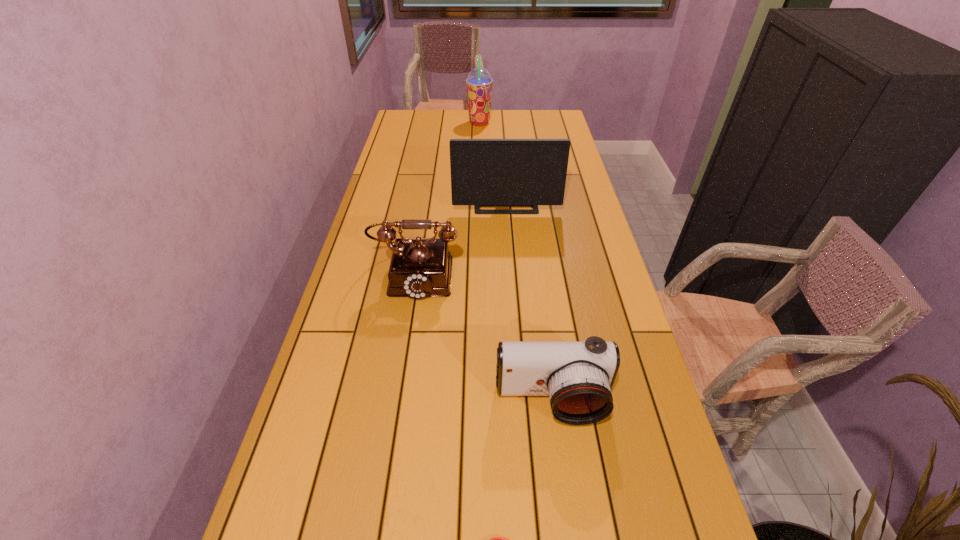
Locate an element on the screen. The height and width of the screenshot is (540, 960). object located at the far edge is located at coordinates (479, 82).

This screenshot has width=960, height=540. I want to click on object that is at the left edge, so click(420, 267).

Identify the location of computer monitor positioned at the right edge. Image resolution: width=960 pixels, height=540 pixels. (484, 172).

This screenshot has height=540, width=960. Find the location of `camcorder located in the right edge section of the desktop`. camcorder located in the right edge section of the desktop is located at coordinates (578, 377).

This screenshot has width=960, height=540. I want to click on free space at the far edge of the desktop, so click(514, 116).

In the image, there is a desktop. Identify the location of free region at the left edge. This screenshot has height=540, width=960. (380, 209).

The image size is (960, 540). In the image, there is a desktop. Identify the location of vacant space at the right edge. (573, 148).

The width and height of the screenshot is (960, 540). I want to click on free spot between the telephone and the second farthest object, so click(x=461, y=239).

Identify the location of free space between the fourth tallest object and the farthest object. The image size is (960, 540). (516, 262).

The width and height of the screenshot is (960, 540). In order to click on vacant space that is in between the camcorder and the third farthest object in this screenshot , I will do `click(484, 338)`.